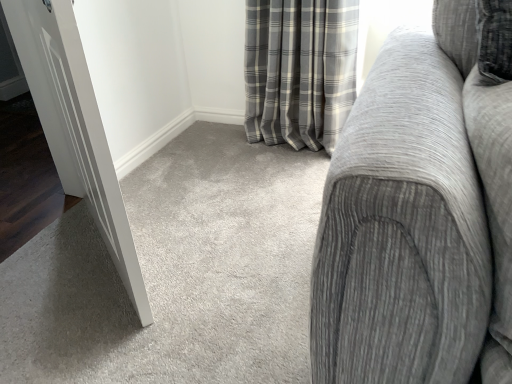
Question: Considering the relative positions of gray fabric couch at right and white glossy door at left in the image provided, is gray fabric couch at right behind white glossy door at left?

Choices:
 (A) no
 (B) yes

Answer: (A)

Question: Considering the relative positions of gray fabric couch at right and white glossy door at left in the image provided, is gray fabric couch at right to the left of white glossy door at left from the viewer's perspective?

Choices:
 (A) yes
 (B) no

Answer: (B)

Question: Can you confirm if gray fabric couch at right is positioned to the right of white glossy door at left?

Choices:
 (A) no
 (B) yes

Answer: (B)

Question: Does gray fabric couch at right have a greater height compared to white glossy door at left?

Choices:
 (A) no
 (B) yes

Answer: (A)

Question: From a real-world perspective, is gray fabric couch at right located beneath white glossy door at left?

Choices:
 (A) no
 (B) yes

Answer: (A)

Question: Is gray fabric couch at right not near white glossy door at left?

Choices:
 (A) no
 (B) yes

Answer: (A)

Question: Is white glossy door at left outside of gray fabric couch at right?

Choices:
 (A) no
 (B) yes

Answer: (B)

Question: Is white glossy door at left in front of gray fabric couch at right?

Choices:
 (A) yes
 (B) no

Answer: (B)

Question: Is gray fabric couch at right completely or partially inside white glossy door at left?

Choices:
 (A) yes
 (B) no

Answer: (B)

Question: Does white glossy door at left have a smaller size compared to gray fabric couch at right?

Choices:
 (A) no
 (B) yes

Answer: (B)

Question: Is white glossy door at left beside gray fabric couch at right?

Choices:
 (A) yes
 (B) no

Answer: (B)

Question: Can you confirm if white glossy door at left is thinner than gray fabric couch at right?

Choices:
 (A) yes
 (B) no

Answer: (A)

Question: Is gray fabric couch at right taller or shorter than white glossy door at left?

Choices:
 (A) short
 (B) tall

Answer: (A)